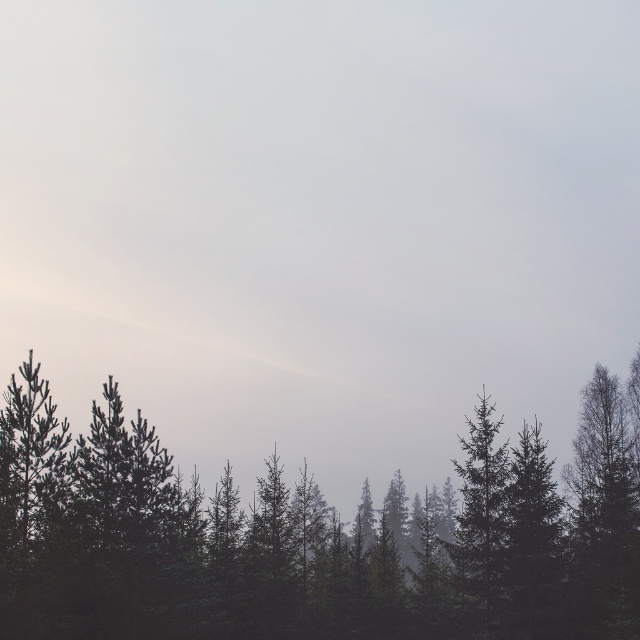
Can you confirm if dark green trees at lower center is wider than green matte tree at center?

Yes.

Which of these two, dark green trees at lower center or green matte tree at center, stands shorter?

Standing shorter between the two is green matte tree at center.

Where is `dark green trees at lower center`? dark green trees at lower center is located at coordinates (x=314, y=536).

Image resolution: width=640 pixels, height=640 pixels. I want to click on dark green trees at lower center, so click(314, 536).